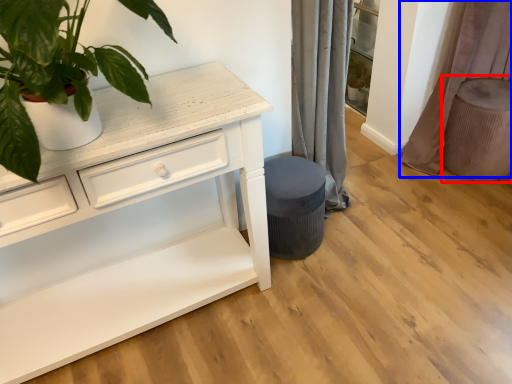
Question: Which of the following is the farthest to the observer, swivel chair (highlighted by a red box) or curtain (highlighted by a blue box)?

Choices:
 (A) swivel chair
 (B) curtain

Answer: (A)